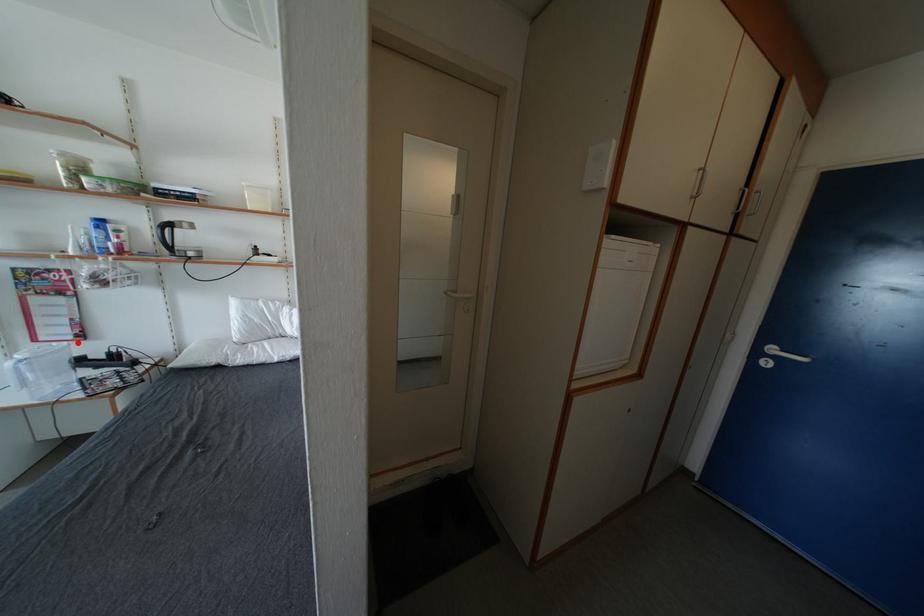
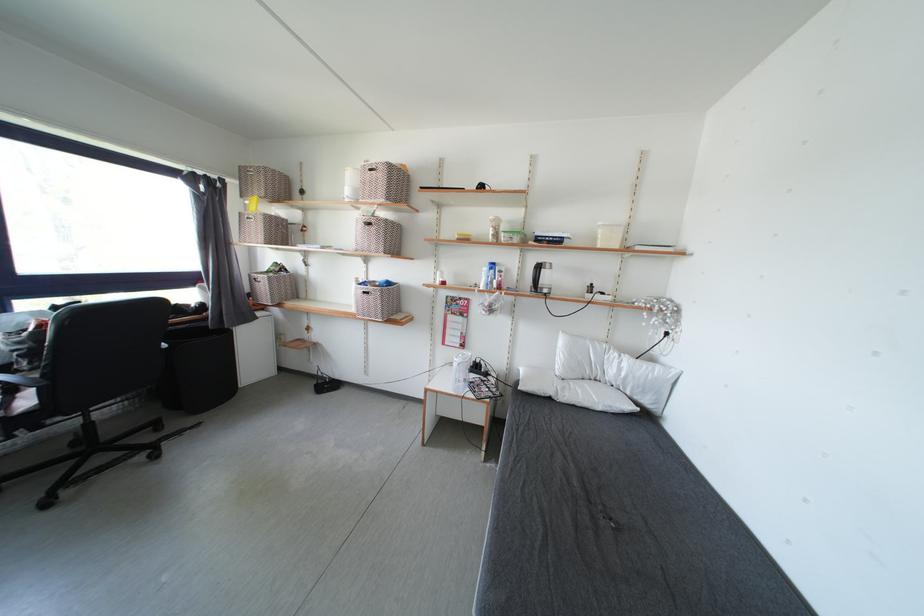
Question: I am providing you with two images of the same scene from different viewpoints. A red point is marked on the first image. Can you still see the location of the red point in image 2?

Choices:
 (A) Yes
 (B) No

Answer: (A)